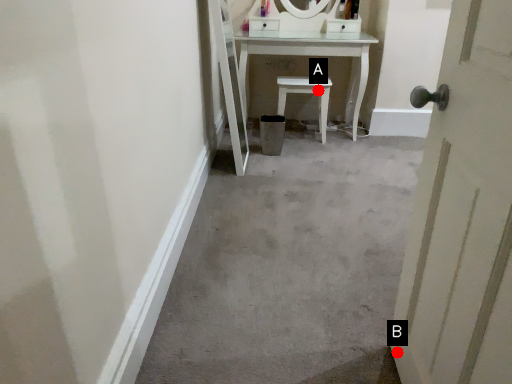
Question: Two points are circled on the image, labeled by A and B beside each circle. Which point is further to the camera?

Choices:
 (A) A is further
 (B) B is further

Answer: (A)